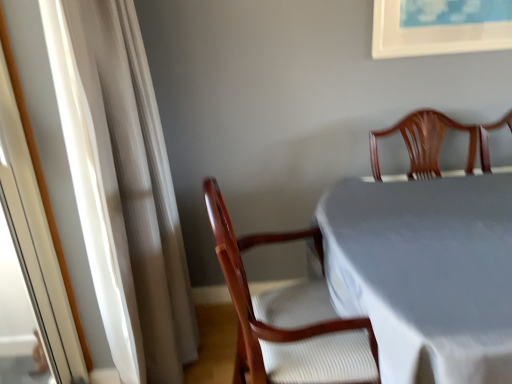
Question: In the image, is white cloth-covered table at center positioned in front of or behind white sheer curtain at left?

Choices:
 (A) front
 (B) behind

Answer: (A)

Question: Considering the positions of white cloth-covered table at center and white sheer curtain at left in the image, is white cloth-covered table at center taller or shorter than white sheer curtain at left?

Choices:
 (A) tall
 (B) short

Answer: (B)

Question: Which of these objects is positioned farthest from the white sheer curtain at left?

Choices:
 (A) white cloth-covered table at center
 (B) wooden chair at center

Answer: (A)

Question: Which is farther from the wooden chair at center?

Choices:
 (A) white cloth-covered table at center
 (B) white sheer curtain at left

Answer: (B)